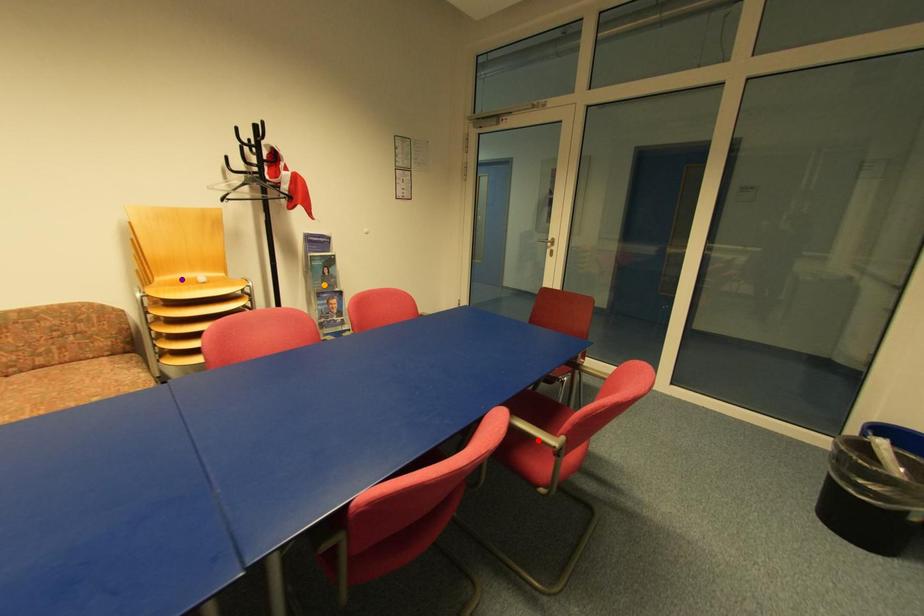
Order these from nearest to farthest:
1. red point
2. purple point
3. orange point

1. red point
2. purple point
3. orange point